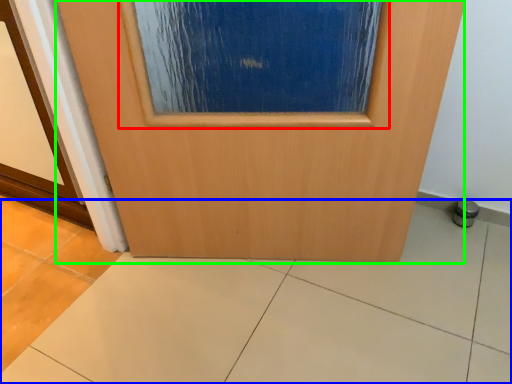
Question: Based on their relative distances, which object is nearer to airplane window (highlighted by a red box)? Choose from ceramic tile (highlighted by a blue box) and door (highlighted by a green box).

Choices:
 (A) ceramic tile
 (B) door

Answer: (B)